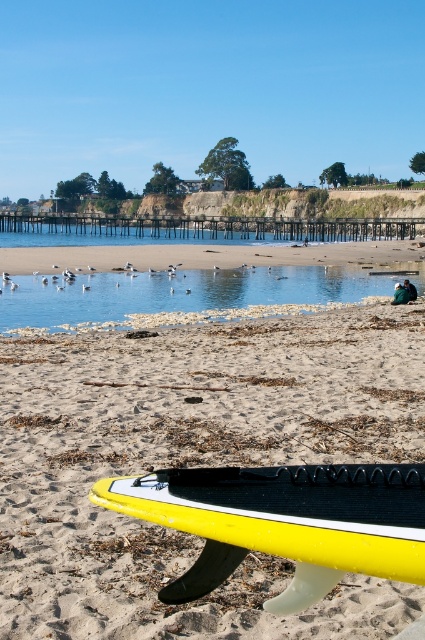
You are standing on the beach looking at the yellow foam surfboard at lower center and the clear water at center. Which object is nearer to you?

The yellow foam surfboard at lower center is closer to the viewer than the clear water at center.

You are a beachgoer who wants to pick up the yellow surfboards from the shore. Which one between the yellow matte surfboard at lower center and the yellow foam surfboard at lower center is taller?

The yellow matte surfboard at lower center is taller than the yellow foam surfboard at lower center.